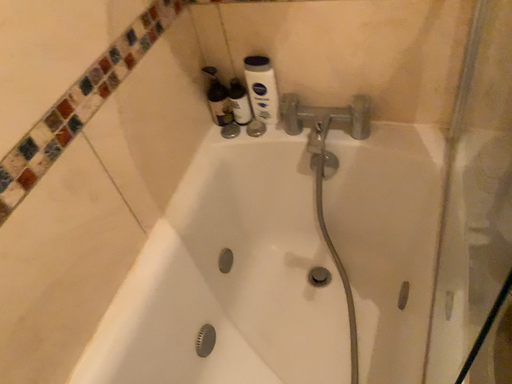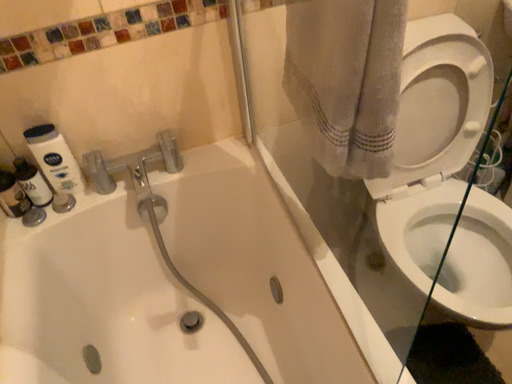
Question: How did the camera likely rotate when shooting the video?

Choices:
 (A) rotated upward
 (B) rotated downward

Answer: (A)